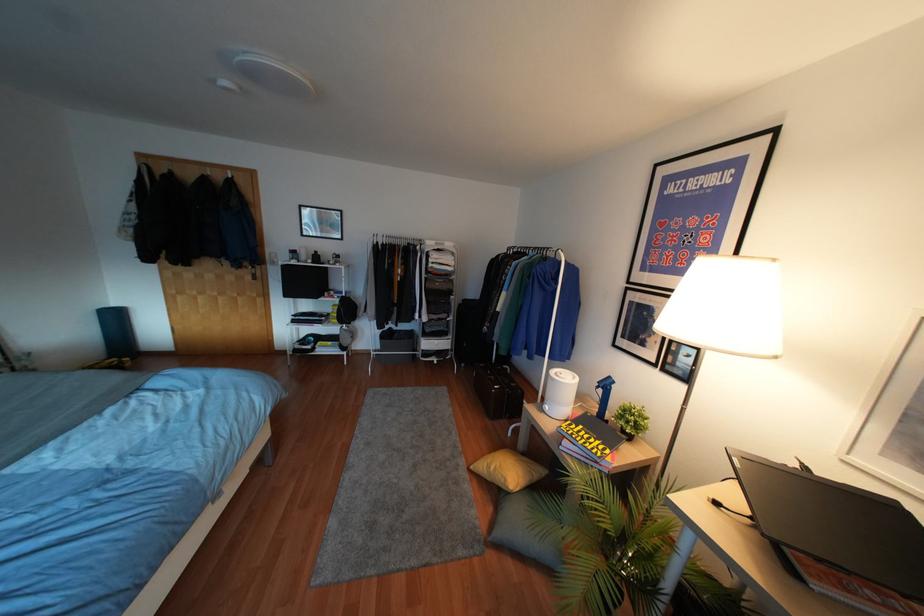
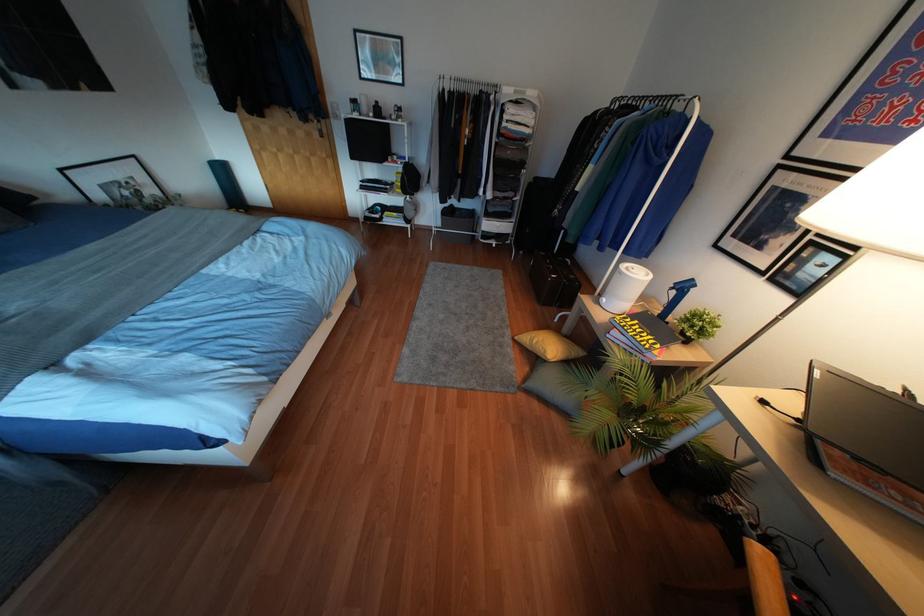
Find the pixel in the second image that matches [492,468] in the first image.

(533, 341)